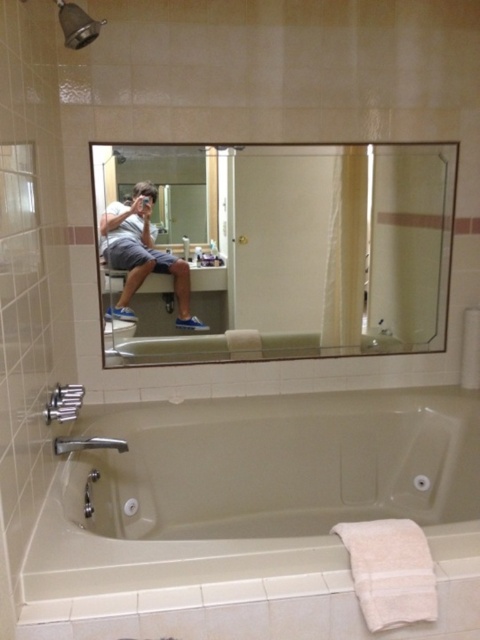
Question: Is clear glass mirror at upper center positioned in front of beige ceramic bathtub at lower center?

Choices:
 (A) no
 (B) yes

Answer: (A)

Question: Does clear glass mirror at upper center have a greater width compared to matte gray shorts at center?

Choices:
 (A) no
 (B) yes

Answer: (B)

Question: Is clear glass mirror at upper center to the left of beige ceramic bathtub at lower center from the viewer's perspective?

Choices:
 (A) yes
 (B) no

Answer: (A)

Question: Which point is closer to the camera?

Choices:
 (A) (128, 285)
 (B) (346, 250)

Answer: (A)

Question: Among these points, which one is nearest to the camera?

Choices:
 (A) (314, 220)
 (B) (256, 458)
 (C) (81, 8)

Answer: (C)

Question: Considering the real-world distances, which object is closest to the clear glass mirror at upper center?

Choices:
 (A) beige ceramic bathtub at lower center
 (B) matte gray shorts at center
 (C) metallic showerhead at upper left

Answer: (B)